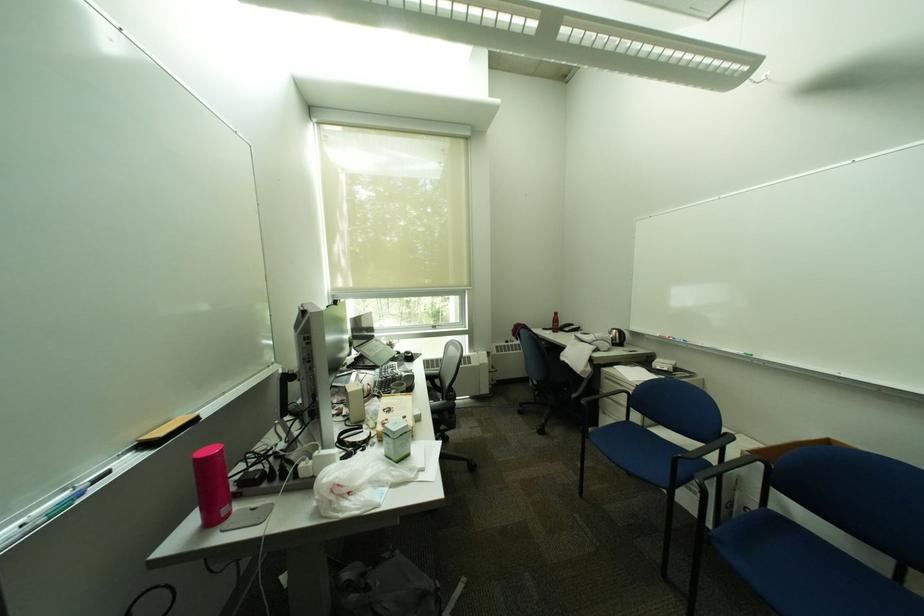
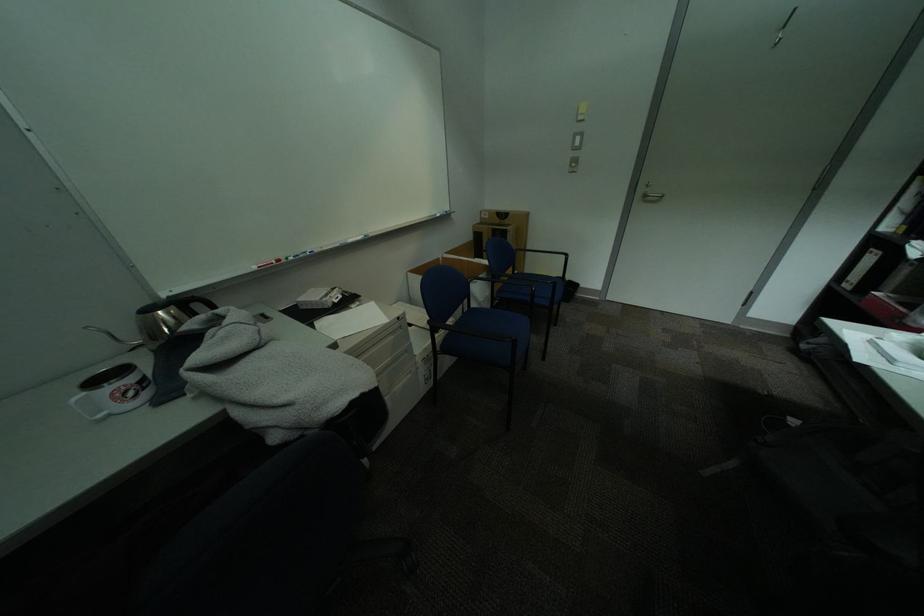
Find the pixel in the second image that matches pixel 634 331 in the first image.

(204, 297)